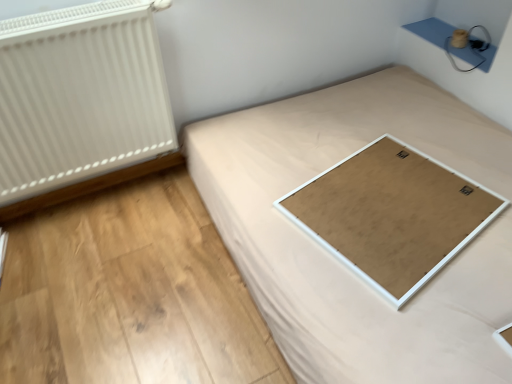
Identify the location of blank space situated above white matte board at center (from a real-world perspective). Image resolution: width=512 pixels, height=384 pixels. (374, 217).